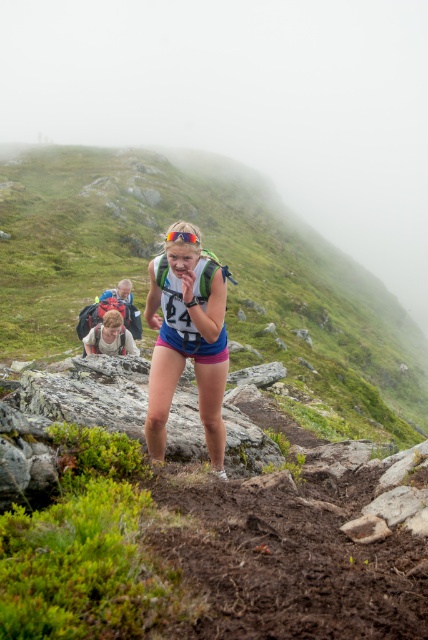
Which of these two, matte blue shorts at center or matte gray backpack at lower left, stands taller?

matte gray backpack at lower left

Image resolution: width=428 pixels, height=640 pixels. Describe the element at coordinates (187, 337) in the screenshot. I see `matte blue shorts at center` at that location.

Does point (151, 356) come in front of point (86, 348)?

Yes.

Locate an element on the screen. The height and width of the screenshot is (640, 428). matte blue shorts at center is located at coordinates (187, 337).

Does matte gray backpack at lower left appear on the right side of matte blue backpack at center?

Indeed, matte gray backpack at lower left is positioned on the right side of matte blue backpack at center.

Between matte gray backpack at lower left and matte blue backpack at center, which one is positioned higher?

matte blue backpack at center is higher up.

Find the location of a particular element. This screenshot has height=640, width=428. matte gray backpack at lower left is located at coordinates (109, 337).

Can you confirm if matte blue shorts at center is positioned above matte blue backpack at center?

Incorrect, matte blue shorts at center is not positioned above matte blue backpack at center.

What do you see at coordinates (187, 337) in the screenshot?
I see `matte blue shorts at center` at bounding box center [187, 337].

This screenshot has height=640, width=428. In order to click on matte blue shorts at center in this screenshot , I will do `click(187, 337)`.